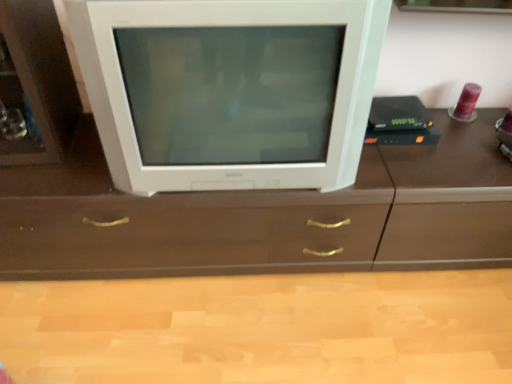
What is the approximate width of brown wood counter top at center?

The width of brown wood counter top at center is 7.14 feet.

This screenshot has height=384, width=512. What do you see at coordinates (262, 329) in the screenshot?
I see `brown wood counter top at center` at bounding box center [262, 329].

Identify the location of brown wood counter top at center. The height and width of the screenshot is (384, 512). (262, 329).

The width and height of the screenshot is (512, 384). What do you see at coordinates (229, 90) in the screenshot?
I see `white glossy television at center` at bounding box center [229, 90].

Locate an element on the screen. This screenshot has width=512, height=384. white glossy television at center is located at coordinates (229, 90).

Where is `brown wood counter top at center`? brown wood counter top at center is located at coordinates (262, 329).

Looking at this image, is brown wood counter top at center to the left of white glossy television at center from the viewer's perspective?

In fact, brown wood counter top at center is to the right of white glossy television at center.

Considering the positions of objects brown wood counter top at center and white glossy television at center in the image provided, who is behind, brown wood counter top at center or white glossy television at center?

Positioned behind is brown wood counter top at center.

Is point (257, 313) more distant than point (129, 150)?

Yes.

From the image's perspective, which is below, brown wood counter top at center or white glossy television at center?

brown wood counter top at center.

From a real-world perspective, which object rests below the other?

brown wood counter top at center.

Consider the image. Is brown wood counter top at center wider or thinner than white glossy television at center?

Clearly, brown wood counter top at center has more width compared to white glossy television at center.

Can you confirm if brown wood counter top at center is shorter than white glossy television at center?

Indeed, brown wood counter top at center has a lesser height compared to white glossy television at center.

Considering the sizes of objects brown wood counter top at center and white glossy television at center in the image provided, who is smaller, brown wood counter top at center or white glossy television at center?

Smaller between the two is brown wood counter top at center.

Choose the correct answer: Is brown wood counter top at center inside white glossy television at center or outside it?

brown wood counter top at center exists outside the volume of white glossy television at center.

From the picture: Is brown wood counter top at center directly adjacent to white glossy television at center?

They are not placed beside each other.

Does brown wood counter top at center turn towards white glossy television at center?

No, brown wood counter top at center does not turn towards white glossy television at center.

What's the angular difference between brown wood counter top at center and white glossy television at center's facing directions?

The angle between the facing direction of brown wood counter top at center and the facing direction of white glossy television at center is 91.8 degrees.

Where is `counter top beneath the white glossy television at center (from a real-world perspective)`? The height and width of the screenshot is (384, 512). counter top beneath the white glossy television at center (from a real-world perspective) is located at coordinates (262, 329).

Is white glossy television at center to the right of brown wood counter top at center from the viewer's perspective?

In fact, white glossy television at center is to the left of brown wood counter top at center.

In the scene shown: Is the depth of white glossy television at center greater than that of brown wood counter top at center?

No, it is in front of brown wood counter top at center.

Does point (72, 31) lie in front of point (265, 367)?

Yes, point (72, 31) is in front of point (265, 367).

From the image's perspective, which object appears higher, white glossy television at center or brown wood counter top at center?

From the image's view, white glossy television at center is above.

From a real-world perspective, who is located lower, white glossy television at center or brown wood counter top at center?

brown wood counter top at center, from a real-world perspective.

Can you confirm if white glossy television at center is thinner than brown wood counter top at center?

Yes, white glossy television at center is thinner than brown wood counter top at center.

Who is taller, white glossy television at center or brown wood counter top at center?

Standing taller between the two is white glossy television at center.

Based on their sizes in the image, would you say white glossy television at center is bigger or smaller than brown wood counter top at center?

In the image, white glossy television at center appears to be larger than brown wood counter top at center.

Choose the correct answer: Is white glossy television at center inside brown wood counter top at center or outside it?

The correct answer is: outside.

Can you see white glossy television at center touching brown wood counter top at center?

A: No, white glossy television at center is not touching brown wood counter top at center.

Is white glossy television at center facing away from brown wood counter top at center?

That's not correct — white glossy television at center is not looking away from brown wood counter top at center.

Measure the distance between white glossy television at center and brown wood counter top at center.

They are 69.32 centimeters apart.

Identify the location of television that is above the brown wood counter top at center (from the image's perspective). (229, 90).

Where is `counter top lying behind the white glossy television at center`? counter top lying behind the white glossy television at center is located at coordinates (262, 329).

Where is `counter top below the white glossy television at center (from the image's perspective)`? The width and height of the screenshot is (512, 384). counter top below the white glossy television at center (from the image's perspective) is located at coordinates (262, 329).